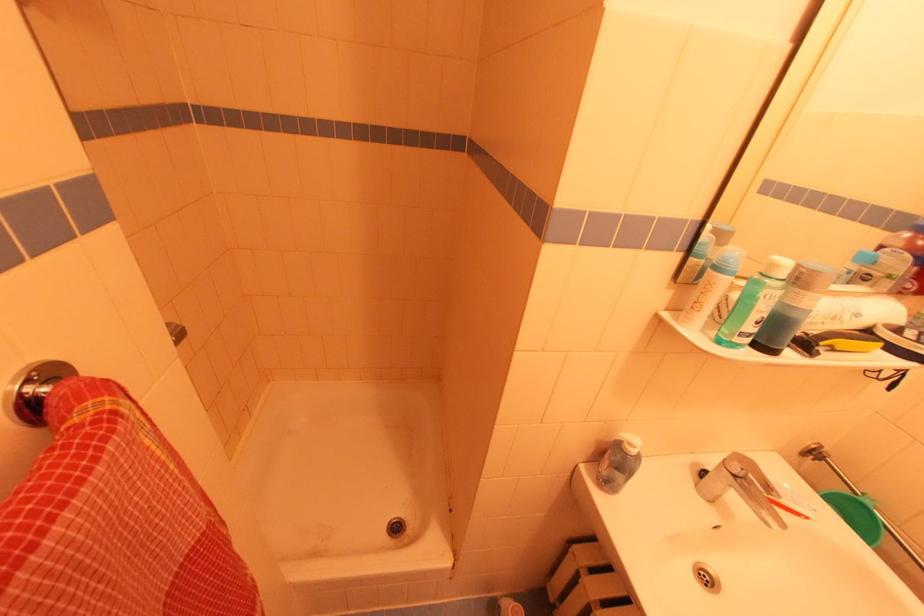
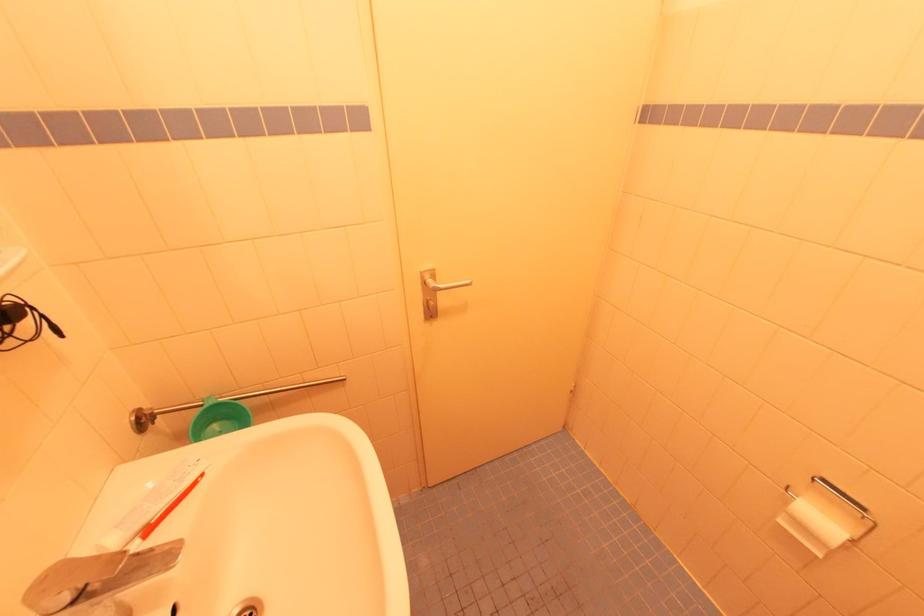
Where in the second image is the point corresponding to (x=805, y=507) from the first image?

(189, 475)